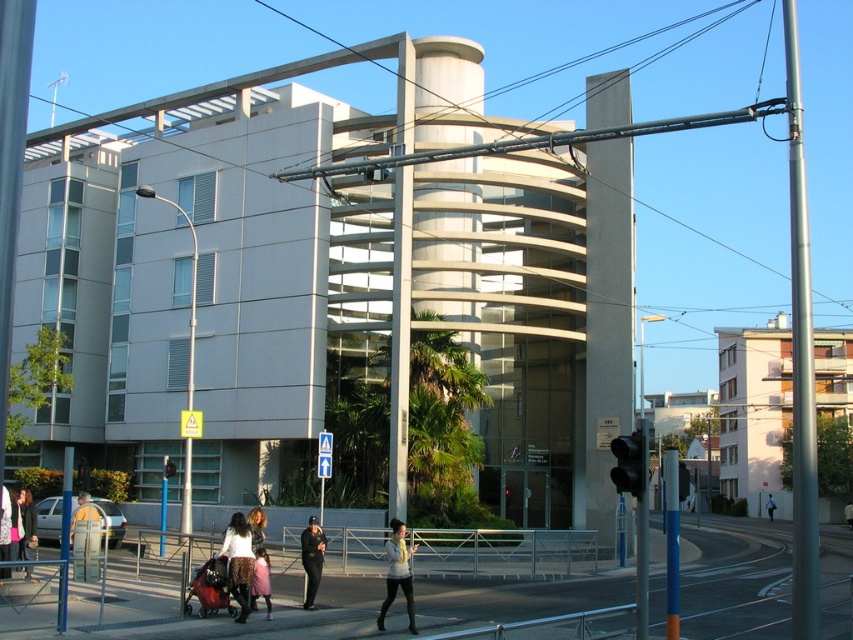
Is point (202, 588) less distant than point (22, 528)?

Yes, point (202, 588) is closer to viewer.

Does point (215, 570) come farther from viewer compared to point (30, 529)?

That is False.

You are a GUI agent. You are given a task and a screenshot of the screen. Output one action in this format:
    pyautogui.click(x=<x>, y=<y>)
    Task: Click on the red fabric baby carriage at lower left
    
    Given the screenshot: What is the action you would take?
    pyautogui.click(x=210, y=588)

Is white textured coat at lower center further to camera compared to pink fabric coat at center?

No, it is not.

Can you confirm if white textured coat at lower center is taller than pink fabric coat at center?

Yes.

Find the location of `white textured coat at lower center`. white textured coat at lower center is located at coordinates (238, 563).

Is pink fabric coat at center above white textured coat at center?

Incorrect, pink fabric coat at center is not positioned above white textured coat at center.

Can you confirm if pink fabric coat at center is bigger than white textured coat at center?

Yes, pink fabric coat at center is bigger than white textured coat at center.

Between point (254, 579) and point (9, 492), which one is positioned behind?

Point (9, 492)

In order to click on pink fabric coat at center in this screenshot , I will do `click(260, 580)`.